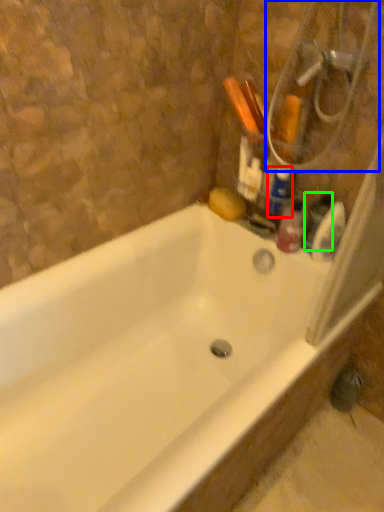
Question: Considering the real-world distances, which object is farthest from cleaning product (highlighted by a red box)? shower (highlighted by a blue box) or toiletry (highlighted by a green box)?

Choices:
 (A) shower
 (B) toiletry

Answer: (A)